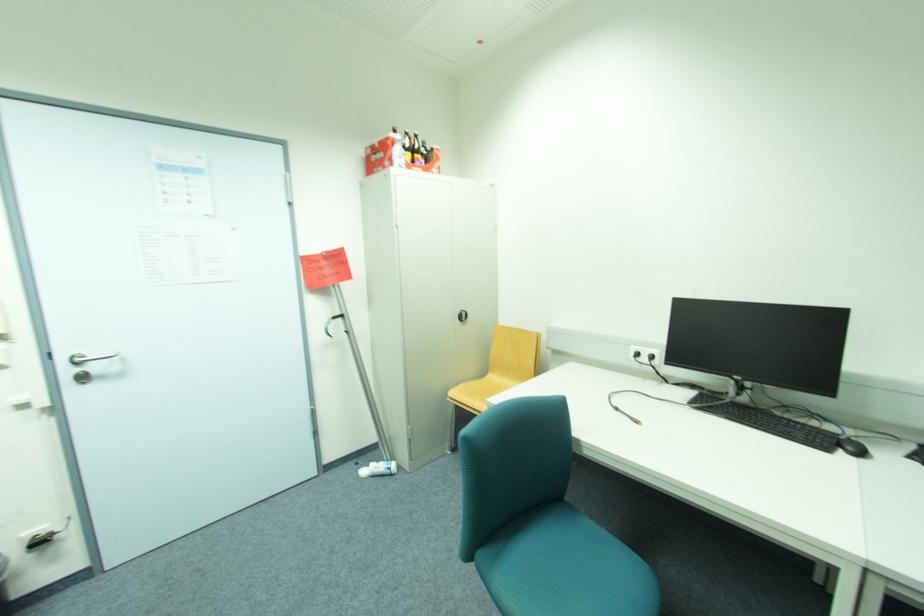
Where is `silver door handle`? This screenshot has height=616, width=924. silver door handle is located at coordinates (92, 366).